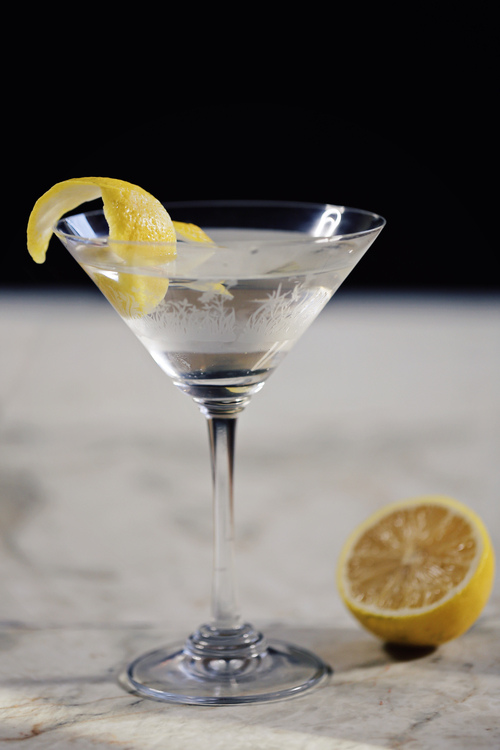
I want to click on countertop, so click(x=272, y=718).